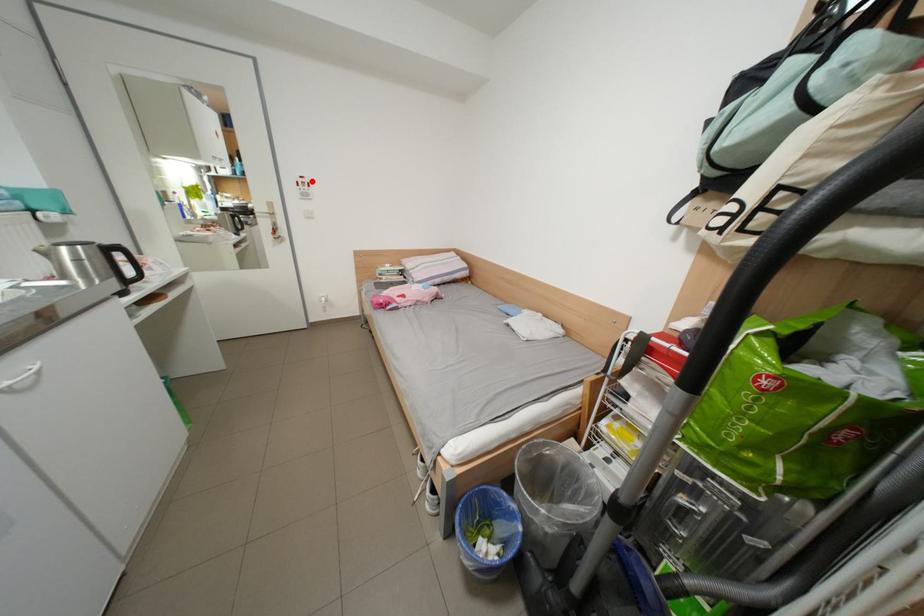
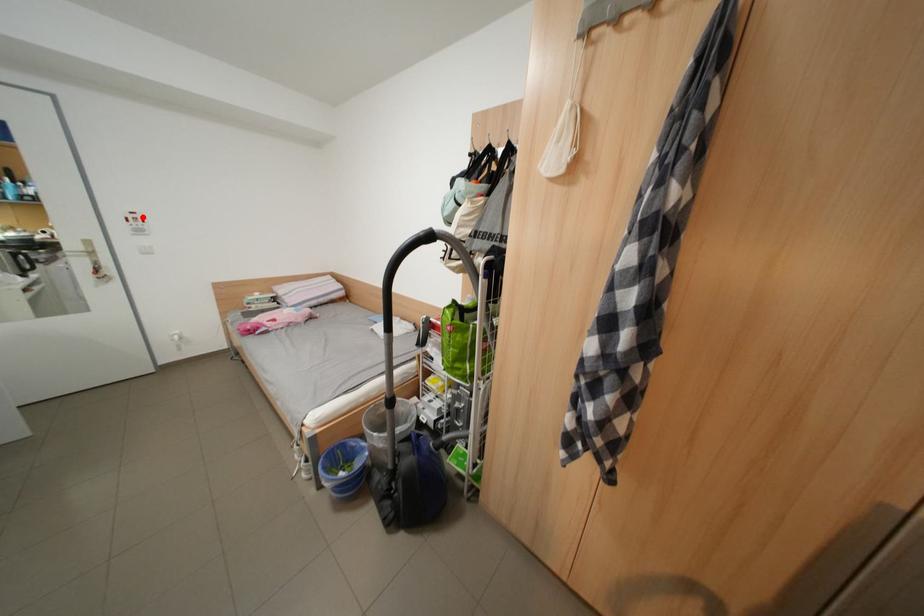
I am providing you with two images of the same scene from different viewpoints. A red point is marked on the first image and another point is marked on the second image. Is the marked point in image1 the same physical position as the marked point in image2?

Yes